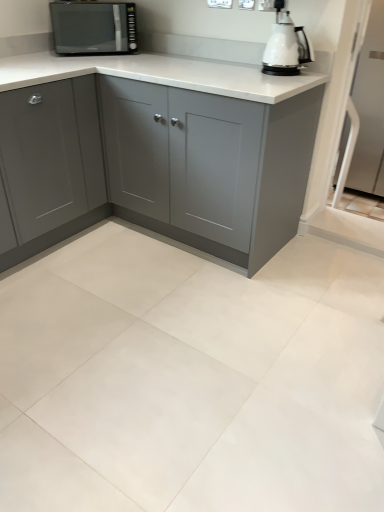
Measure the distance between point (288,33) and camera.

Point (288,33) is 1.90 meters away from camera.

What is the approximate height of matte gray cabinet at left, the second cabinetry from the right?

The height of matte gray cabinet at left, the second cabinetry from the right, is 38.49 inches.

Where is `white glossy kettle at upper right`? The width and height of the screenshot is (384, 512). white glossy kettle at upper right is located at coordinates (286, 45).

What are the coordinates of `cabinetry that is the 2nd object located below the white glossy kettle at upper right (from the image's perspective)` in the screenshot? It's located at (51, 164).

Which is closer to the camera, (282, 0) or (81, 197)?

The point (282, 0) is closer to the camera.

Are white glossy kettle at upper right and matte gray cabinet at left, the second cabinetry from the right, making contact?

No, white glossy kettle at upper right is not next to matte gray cabinet at left, the second cabinetry from the right.

How many degrees apart are the facing directions of white glossy kettle at upper right and matte gray cabinet at left, which is counted as the first cabinetry, starting from the left?

91.1 degrees separate the facing orientations of white glossy kettle at upper right and matte gray cabinet at left, which is counted as the first cabinetry, starting from the left.

Which is behind, matte gray cabinet at left, which is counted as the first cabinetry, starting from the left, or matte gray cabinet at center, the second cabinetry in the left-to-right sequence?

matte gray cabinet at center, the second cabinetry in the left-to-right sequence, is behind.

Could you tell me if matte gray cabinet at left, which is counted as the first cabinetry, starting from the left, is turned towards matte gray cabinet at center, the second cabinetry in the left-to-right sequence?

No, matte gray cabinet at left, which is counted as the first cabinetry, starting from the left, is not turned towards matte gray cabinet at center, the second cabinetry in the left-to-right sequence.

This screenshot has width=384, height=512. Identify the location of cabinetry behind the matte gray cabinet at left, which is counted as the first cabinetry, starting from the left. (170, 149).

Is matte gray cabinet at left, which is counted as the first cabinetry, starting from the left, in contact with matte gray cabinet at center, which is the first cabinetry in right-to-left order?

No, matte gray cabinet at left, which is counted as the first cabinetry, starting from the left, is not making contact with matte gray cabinet at center, which is the first cabinetry in right-to-left order.

Which is behind, point (71, 40) or point (96, 213)?

The point (96, 213) is farther from the camera.

Which object is positioned more to the left, satin black microwave at upper left or matte gray cabinet at center, the second cabinetry in the left-to-right sequence?

satin black microwave at upper left.

Does satin black microwave at upper left have a lesser height compared to matte gray cabinet at center, the second cabinetry in the left-to-right sequence?

Yes.

Does satin black microwave at upper left come in front of matte gray cabinet at center, which is the first cabinetry in right-to-left order?

No.

From the image's perspective, does satin black microwave at upper left appear higher than matte gray cabinet at left, which is counted as the first cabinetry, starting from the left?

Yes, from the image's perspective, satin black microwave at upper left is on top of matte gray cabinet at left, which is counted as the first cabinetry, starting from the left.

This screenshot has height=512, width=384. In order to click on cabinetry on the left of satin black microwave at upper left in this screenshot , I will do `click(51, 164)`.

Which object is closer to the camera, satin black microwave at upper left or matte gray cabinet at left, the second cabinetry from the right?

matte gray cabinet at left, the second cabinetry from the right, is closer to the camera.

Is matte gray cabinet at left, which is counted as the first cabinetry, starting from the left, touching white glossy kettle at upper right?

No, matte gray cabinet at left, which is counted as the first cabinetry, starting from the left, is not in contact with white glossy kettle at upper right.

You are a GUI agent. You are given a task and a screenshot of the screen. Output one action in this format:
    pyautogui.click(x=<x>, y=<y>)
    Task: Click on the home appliance located behind the matte gray cabinet at left, which is counted as the first cabinetry, starting from the left
    
    Given the screenshot: What is the action you would take?
    pyautogui.click(x=286, y=45)

Is white glossy kettle at upper right inside matte gray cabinet at left, which is counted as the first cabinetry, starting from the left?

No, white glossy kettle at upper right is located outside of matte gray cabinet at left, which is counted as the first cabinetry, starting from the left.

From a real-world perspective, who is located higher, matte gray cabinet at left, the second cabinetry from the right, or white glossy kettle at upper right?

white glossy kettle at upper right, from a real-world perspective.

You are a GUI agent. You are given a task and a screenshot of the screen. Output one action in this format:
    pyautogui.click(x=<x>, y=<y>)
    Task: Click on the cabinetry that is the 2nd object directly below the white glossy kettle at upper right (from a real-world perspective)
    The height and width of the screenshot is (512, 384).
    Given the screenshot: What is the action you would take?
    pyautogui.click(x=170, y=149)

Who is bigger, matte gray cabinet at center, the second cabinetry in the left-to-right sequence, or white glossy kettle at upper right?

matte gray cabinet at center, the second cabinetry in the left-to-right sequence.

Considering the sizes of matte gray cabinet at center, which is the first cabinetry in right-to-left order, and white glossy kettle at upper right in the image, is matte gray cabinet at center, which is the first cabinetry in right-to-left order, wider or thinner than white glossy kettle at upper right?

Considering their sizes, matte gray cabinet at center, which is the first cabinetry in right-to-left order, looks broader than white glossy kettle at upper right.

At what (x,y) coordinates should I click in order to perform the action: click on kitchen appliance above the matte gray cabinet at left, which is counted as the first cabinetry, starting from the left (from the image's perspective). Please return your answer as a coordinate pair (x, y). Looking at the image, I should click on (93, 27).

Is matte gray cabinet at left, the second cabinetry from the right, not inside satin black microwave at upper left?

Yes.

Is matte gray cabinet at left, which is counted as the first cabinetry, starting from the left, closer to the viewer compared to satin black microwave at upper left?

Yes, the depth of matte gray cabinet at left, which is counted as the first cabinetry, starting from the left, is less than that of satin black microwave at upper left.

Is point (21, 189) farther from camera compared to point (121, 6)?

No, it is not.

Identify the location of home appliance behind the matte gray cabinet at left, the second cabinetry from the right. This screenshot has height=512, width=384. (286, 45).

This screenshot has height=512, width=384. In order to click on cabinetry on the right of matte gray cabinet at left, the second cabinetry from the right in this screenshot , I will do `click(170, 149)`.

Based on their spatial positions, is matte gray cabinet at center, which is the first cabinetry in right-to-left order, or white glossy kettle at upper right closer to satin black microwave at upper left?

matte gray cabinet at center, which is the first cabinetry in right-to-left order, is positioned closer to the anchor satin black microwave at upper left.

Based on their spatial positions, is matte gray cabinet at left, which is counted as the first cabinetry, starting from the left, or satin black microwave at upper left further from matte gray cabinet at center, which is the first cabinetry in right-to-left order?

satin black microwave at upper left is positioned further to the anchor matte gray cabinet at center, which is the first cabinetry in right-to-left order.

Considering their positions, is white glossy kettle at upper right positioned further to matte gray cabinet at left, which is counted as the first cabinetry, starting from the left, than matte gray cabinet at center, the second cabinetry in the left-to-right sequence?

white glossy kettle at upper right lies further to matte gray cabinet at left, which is counted as the first cabinetry, starting from the left, than the other object.

Looking at the image, which one is located further to white glossy kettle at upper right, matte gray cabinet at left, which is counted as the first cabinetry, starting from the left, or satin black microwave at upper left?

The object further to white glossy kettle at upper right is matte gray cabinet at left, which is counted as the first cabinetry, starting from the left.

Which object lies further to the anchor point satin black microwave at upper left, white glossy kettle at upper right or matte gray cabinet at center, which is the first cabinetry in right-to-left order?

white glossy kettle at upper right is further to satin black microwave at upper left.

Which object lies nearer to the anchor point matte gray cabinet at center, which is the first cabinetry in right-to-left order, white glossy kettle at upper right or satin black microwave at upper left?

The object closer to matte gray cabinet at center, which is the first cabinetry in right-to-left order, is white glossy kettle at upper right.

Looking at the image, which one is located closer to matte gray cabinet at left, the second cabinetry from the right, white glossy kettle at upper right or satin black microwave at upper left?

satin black microwave at upper left is positioned closer to the anchor matte gray cabinet at left, the second cabinetry from the right.

Based on their spatial positions, is matte gray cabinet at center, the second cabinetry in the left-to-right sequence, or satin black microwave at upper left further from matte gray cabinet at left, which is counted as the first cabinetry, starting from the left?

satin black microwave at upper left.

Where is `cabinetry between matte gray cabinet at left, the second cabinetry from the right, and white glossy kettle at upper right`? Image resolution: width=384 pixels, height=512 pixels. cabinetry between matte gray cabinet at left, the second cabinetry from the right, and white glossy kettle at upper right is located at coordinates (170, 149).

You are a GUI agent. You are given a task and a screenshot of the screen. Output one action in this format:
    pyautogui.click(x=<x>, y=<y>)
    Task: Click on the kitchen appliance between matte gray cabinet at left, the second cabinetry from the right, and matte gray cabinet at center, which is the first cabinetry in right-to-left order, in the horizontal direction
    The image size is (384, 512).
    Given the screenshot: What is the action you would take?
    pyautogui.click(x=93, y=27)

This screenshot has height=512, width=384. I want to click on cabinetry situated between satin black microwave at upper left and white glossy kettle at upper right from left to right, so click(170, 149).

Find the location of `kitchen appliance between matte gray cabinet at left, the second cabinetry from the right, and white glossy kettle at upper right from left to right`. kitchen appliance between matte gray cabinet at left, the second cabinetry from the right, and white glossy kettle at upper right from left to right is located at coordinates pyautogui.click(x=93, y=27).